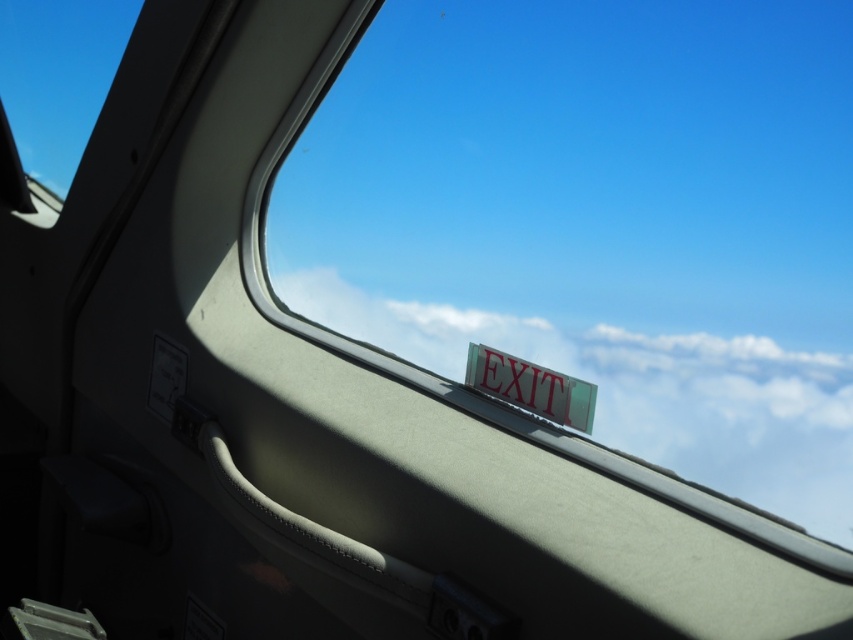
You are a flight attendant checking the cabin. You notice the white fluffy cloud at upper center and the transparent glass window at upper left. Which object appears smaller in size?

The white fluffy cloud at upper center has a smaller size compared to the transparent glass window at upper left, so the white fluffy cloud at upper center appears smaller.